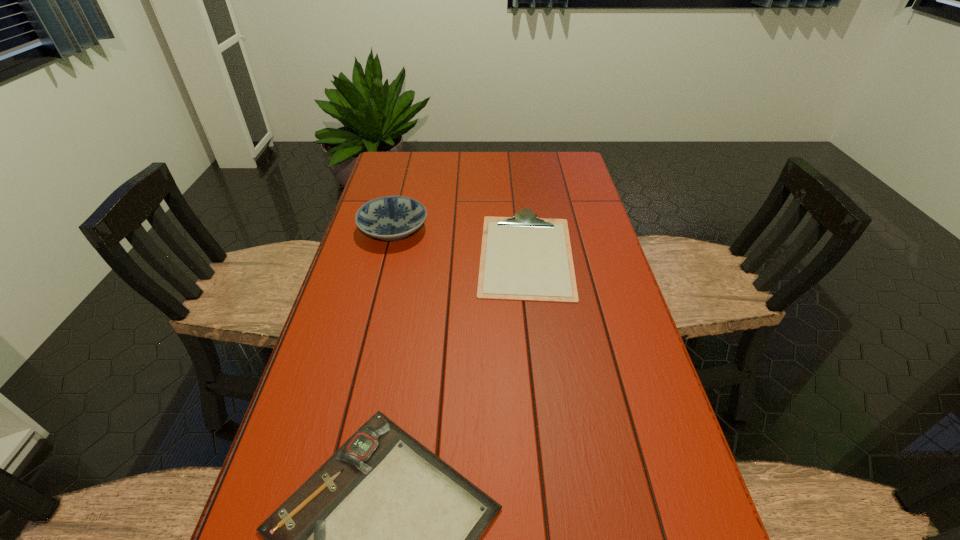
You are a GUI agent. You are given a task and a screenshot of the screen. Output one action in this format:
    pyautogui.click(x=<x>, y=<y>)
    Task: Click on the plate
    The image size is (960, 540).
    Given the screenshot: What is the action you would take?
    pyautogui.click(x=391, y=218)

You are a GUI agent. You are given a task and a screenshot of the screen. Output one action in this format:
    pyautogui.click(x=<x>, y=<y>)
    Task: Click on the second shortest object
    The image size is (960, 540).
    Given the screenshot: What is the action you would take?
    pyautogui.click(x=526, y=258)

Locate an element on the screen. The width and height of the screenshot is (960, 540). the farther clipboard is located at coordinates (526, 258).

Identify the location of blank space located on the right of the plate. Image resolution: width=960 pixels, height=540 pixels. (447, 229).

Where is `vacant space located on the back of the taller clipboard`? vacant space located on the back of the taller clipboard is located at coordinates (516, 179).

The height and width of the screenshot is (540, 960). I want to click on object that is at the left edge, so click(391, 218).

Identify the location of object located in the right edge section of the desktop. (526, 258).

At what (x,y) coordinates should I click in order to perform the action: click on vacant space at the far edge of the desktop. Please return your answer as a coordinate pair (x, y). The width and height of the screenshot is (960, 540). Looking at the image, I should click on click(x=505, y=170).

Identify the location of free space at the left edge of the desktop. The image size is (960, 540). (335, 328).

This screenshot has width=960, height=540. I want to click on vacant space at the right edge of the desktop, so tap(577, 262).